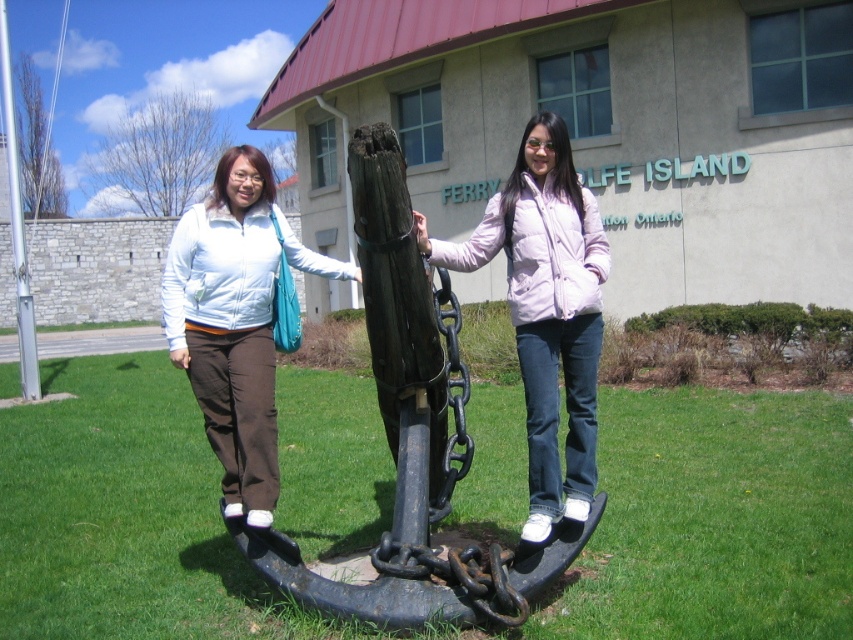
Question: Is green grass at center further to camera compared to silver metallic pole at left?

Choices:
 (A) yes
 (B) no

Answer: (B)

Question: Is green grass at center positioned in front of light pink puffy jacket at center?

Choices:
 (A) no
 (B) yes

Answer: (B)

Question: Which point is closer to the camera?

Choices:
 (A) light pink puffy jacket at center
 (B) green grass at center

Answer: (B)

Question: Can you confirm if green grass at center is positioned to the right of silver metallic pole at left?

Choices:
 (A) no
 (B) yes

Answer: (B)

Question: Which point is closer to the camera taking this photo?

Choices:
 (A) (235, 330)
 (B) (19, 298)
 (C) (576, 269)
 (D) (340, 406)

Answer: (C)

Question: Estimate the real-world distances between objects in this image. Which object is closer to the light blue zip-up jacket at center?

Choices:
 (A) silver metallic pole at left
 (B) green grass at center
 (C) light pink puffy jacket at center

Answer: (C)